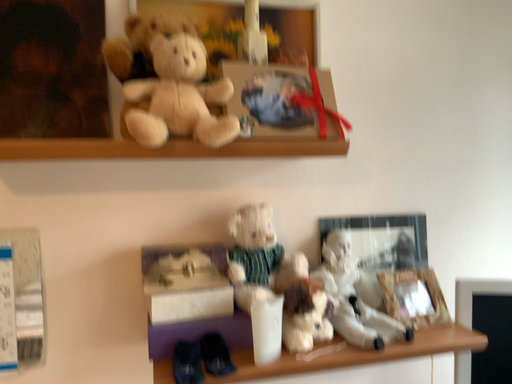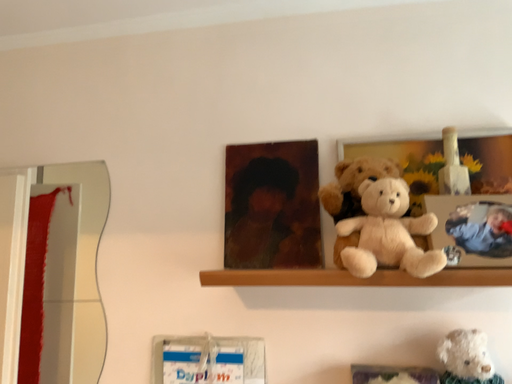
Question: Which way did the camera rotate in the video?

Choices:
 (A) rotated right
 (B) rotated left

Answer: (B)